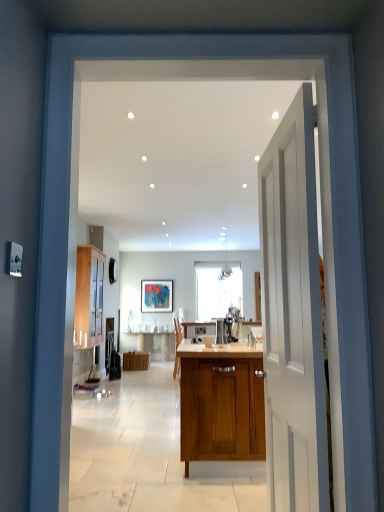
Question: From a real-world perspective, is white smooth door at right positioned under wooden cabinet at left, the second cabinetry when ordered from right to left, based on gravity?

Choices:
 (A) yes
 (B) no

Answer: (A)

Question: Is wooden cabinet at left, the second cabinetry from the back, at the back of white smooth door at right?

Choices:
 (A) yes
 (B) no

Answer: (B)

Question: Is white smooth door at right taller than wooden cabinet at left, the second cabinetry when ordered from bottom to top?

Choices:
 (A) no
 (B) yes

Answer: (B)

Question: Is white smooth door at right closer to the viewer compared to wooden cabinet at left, the second cabinetry from the back?

Choices:
 (A) yes
 (B) no

Answer: (A)

Question: Is white smooth door at right at the right side of wooden cabinet at left, which ranks as the first cabinetry in left-to-right order?

Choices:
 (A) yes
 (B) no

Answer: (A)

Question: Would you say white smooth door at right is outside wooden cabinet at left, which ranks as the first cabinetry in left-to-right order?

Choices:
 (A) yes
 (B) no

Answer: (A)

Question: Is wooden cabinet at left, which ranks as the first cabinetry in left-to-right order, placed right next to wooden cabinet at center, positioned as the second cabinetry in front-to-back order?

Choices:
 (A) yes
 (B) no

Answer: (B)

Question: Can you confirm if wooden cabinet at left, which ranks as the first cabinetry in left-to-right order, is thinner than wooden cabinet at center, the first cabinetry when ordered from bottom to top?

Choices:
 (A) no
 (B) yes

Answer: (B)

Question: Does wooden cabinet at left, the second cabinetry from the back, have a greater width compared to wooden cabinet at center, which appears as the 1th cabinetry when viewed from the right?

Choices:
 (A) no
 (B) yes

Answer: (A)

Question: Does wooden cabinet at left, placed as the 1th cabinetry when sorted from front to back, have a lesser height compared to wooden cabinet at center, the first cabinetry when ordered from bottom to top?

Choices:
 (A) yes
 (B) no

Answer: (B)

Question: Is wooden cabinet at left, which ranks as the first cabinetry in left-to-right order, smaller than wooden cabinet at center, the first cabinetry when ordered from bottom to top?

Choices:
 (A) yes
 (B) no

Answer: (B)

Question: Does wooden cabinet at left, which ranks as the first cabinetry in left-to-right order, come behind wooden cabinet at center, which appears as the 1th cabinetry when viewed from the right?

Choices:
 (A) yes
 (B) no

Answer: (B)

Question: Is white smooth door at right not within satin silver coffee machine at center?

Choices:
 (A) yes
 (B) no

Answer: (A)